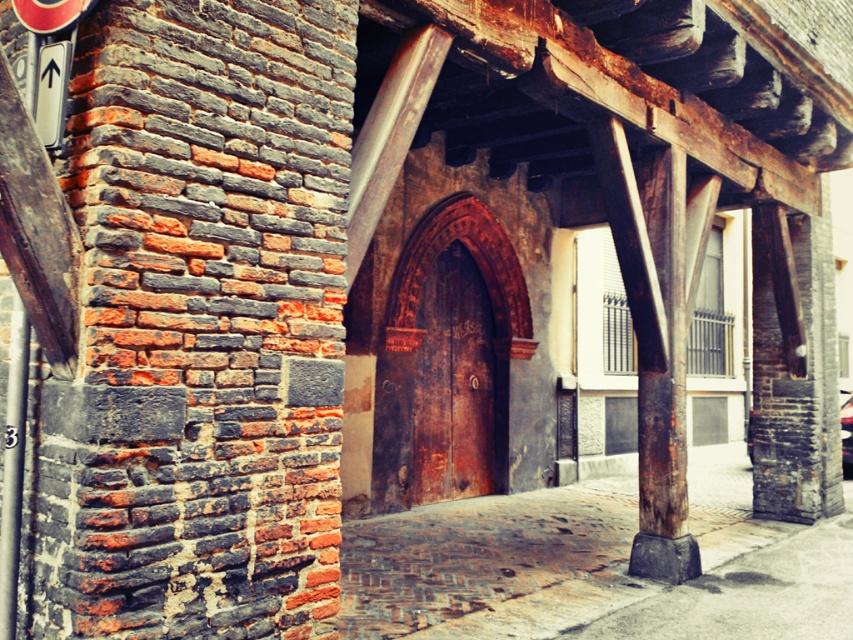
What do you see at coordinates (13, 465) in the screenshot? Image resolution: width=853 pixels, height=640 pixels. I see `metallic gray pole at left` at bounding box center [13, 465].

Looking at this image, between metallic gray pole at left and metallic silver car at center, which one is positioned lower?

metallic silver car at center is below.

Who is more distant from viewer, (16, 358) or (845, 464)?

The point (845, 464) is behind.

The width and height of the screenshot is (853, 640). I want to click on metallic gray pole at left, so tap(13, 465).

Does white plastic sign at upper left have a larger size compared to metallic silver car at center?

No, white plastic sign at upper left is not bigger than metallic silver car at center.

Looking at this image, between white plastic sign at upper left and metallic silver car at center, which one appears on the right side from the viewer's perspective?

Positioned to the right is metallic silver car at center.

Is point (41, 115) positioned in front of point (846, 456)?

That is True.

The height and width of the screenshot is (640, 853). Identify the location of white plastic sign at upper left. (51, 92).

Who is lower down, rustic stone pavement at center or metallic silver car at center?

rustic stone pavement at center is lower down.

Which of these two, rustic stone pavement at center or metallic silver car at center, stands taller?

Standing taller between the two is metallic silver car at center.

Image resolution: width=853 pixels, height=640 pixels. What are the coordinates of `rustic stone pavement at center` in the screenshot? It's located at (595, 564).